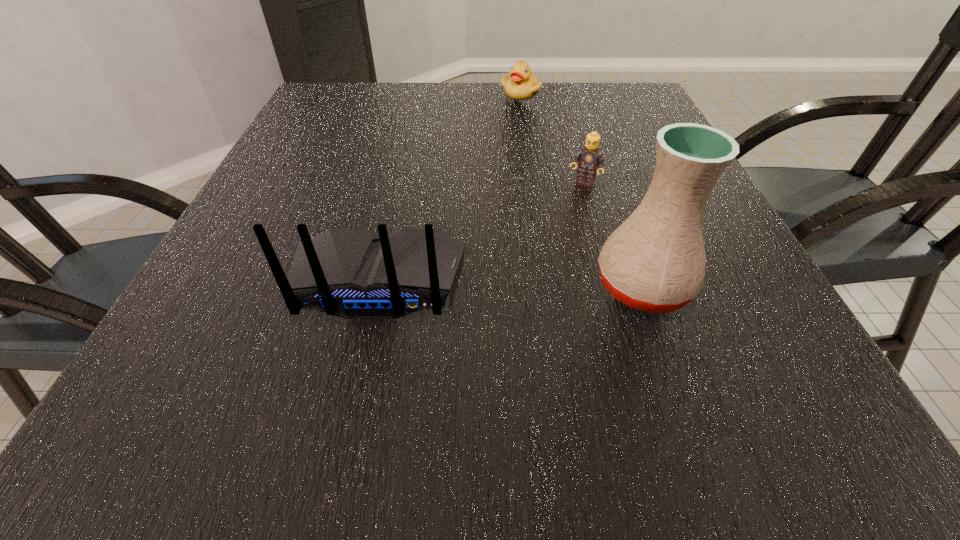
Identify the location of vacant area situated in front of the third nearest object. The height and width of the screenshot is (540, 960). (527, 305).

I want to click on free region located 0.100m in front of the third nearest object, so click(566, 217).

Locate an element on the screen. This screenshot has height=540, width=960. vacant space located on the front-facing side of the farthest object is located at coordinates (519, 110).

Identify the location of blank area located on the front-facing side of the farthest object. Image resolution: width=960 pixels, height=540 pixels. (518, 114).

Image resolution: width=960 pixels, height=540 pixels. Identify the location of free space located on the front-facing side of the farthest object. pyautogui.click(x=514, y=183).

Where is `object positioned at the far edge`? object positioned at the far edge is located at coordinates (522, 84).

Locate an element on the screen. This screenshot has width=960, height=540. router at the near edge is located at coordinates (351, 273).

Find the location of a particular element. pottery present at the near edge is located at coordinates (655, 261).

Locate an element on the screen. object at the left edge is located at coordinates (351, 273).

Locate an element on the screen. object located in the right edge section of the desktop is located at coordinates (655, 261).